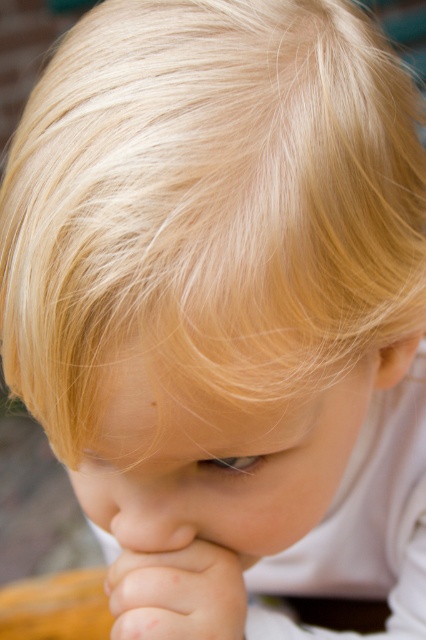
Based on the scene, which object has a greater width, the blonde silky hair at upper center or the smooth skin hand at lower center?

The blonde silky hair at upper center has a greater width than the smooth skin hand at lower center.

From the picture: You are a photographer adjusting your camera to focus on the blonde silky hair at upper center. What are the exact coordinates where you should position the focus point?

The exact coordinates for focusing on the blonde silky hair at upper center are at point 0.319 on the x axis and 0.493 on the y axis.